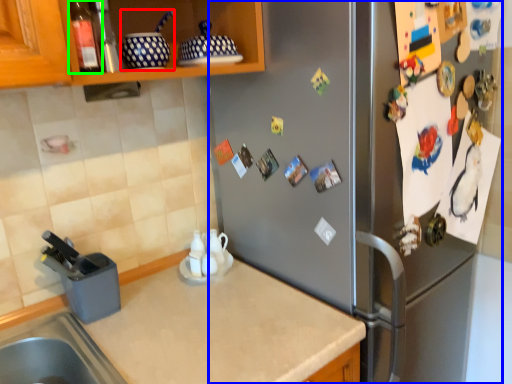
Question: Considering the real-world distances, which object is closest to appliance (highlighted by a red box)? fridge (highlighted by a blue box) or bottle (highlighted by a green box).

Choices:
 (A) fridge
 (B) bottle

Answer: (B)